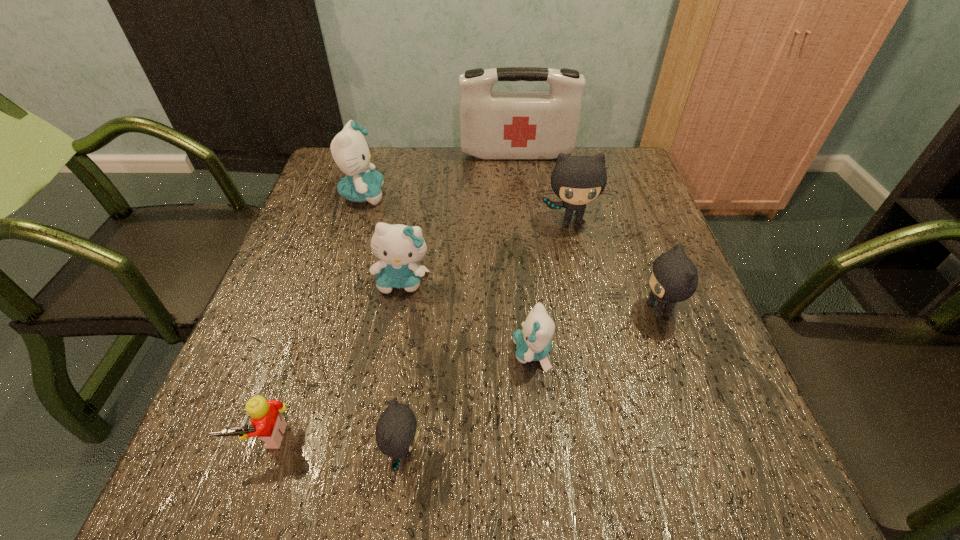
Where is `vacant space at the far right corner of the desktop`? This screenshot has height=540, width=960. vacant space at the far right corner of the desktop is located at coordinates pyautogui.click(x=631, y=189).

Locate an element on the screen. The image size is (960, 540). blank space at the near right corner of the desktop is located at coordinates (668, 461).

The height and width of the screenshot is (540, 960). What are the coordinates of `free space that is in between the rightmost blue kitten and the Lego` in the screenshot? It's located at (398, 395).

Find the location of a particular element. empty space that is in between the second nearest blue kitten and the rightmost blue kitten is located at coordinates (468, 317).

At what (x,y) coordinates should I click in order to perform the action: click on free space between the nearest kitten and the rightmost blue kitten. Please return your answer as a coordinate pair (x, y). Image resolution: width=960 pixels, height=540 pixels. Looking at the image, I should click on (468, 402).

Locate an element on the screen. unoccupied position between the nearest gray kitten and the rightmost blue kitten is located at coordinates (468, 402).

I want to click on blank region between the smallest gray kitten and the rightmost kitten, so [x=531, y=380].

At what (x,y) coordinates should I click in order to perform the action: click on unoccupied area between the smallest blue kitten and the biggest blue kitten. Please return your answer as a coordinate pair (x, y). Looking at the image, I should click on (447, 274).

In order to click on vacant space that is in between the smallest blue kitten and the rightmost kitten in this screenshot , I will do `click(595, 331)`.

Where is `blank region between the Lego and the red first-aid kit`? blank region between the Lego and the red first-aid kit is located at coordinates (391, 295).